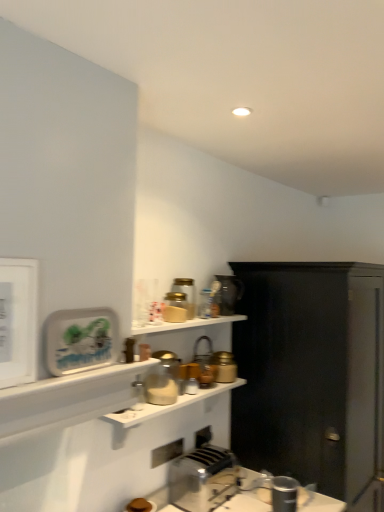
Question: Is matte white plate at upper left, which is the 4th appliance from top to bottom, located outside metallic faucet at upper center, the 3th appliance in the bottom-to-top sequence?

Choices:
 (A) no
 (B) yes

Answer: (B)

Question: Considering the relative sizes of matte white plate at upper left, the 7th appliance when ordered from back to front, and metallic faucet at upper center, the 3th appliance in the bottom-to-top sequence, in the image provided, is matte white plate at upper left, the 7th appliance when ordered from back to front, smaller than metallic faucet at upper center, the 3th appliance in the bottom-to-top sequence,?

Choices:
 (A) no
 (B) yes

Answer: (B)

Question: From a real-world perspective, is matte white plate at upper left, the 7th appliance when ordered from back to front, below metallic faucet at upper center, the 5th appliance positioned from the front?

Choices:
 (A) yes
 (B) no

Answer: (B)

Question: Is matte white plate at upper left, positioned as the 4th appliance in bottom-to-top order, thinner than metallic faucet at upper center, the 5th appliance positioned from the front?

Choices:
 (A) no
 (B) yes

Answer: (B)

Question: Is matte white plate at upper left, which is the first appliance from front to back, wider than metallic faucet at upper center, the 3th appliance in the bottom-to-top sequence?

Choices:
 (A) no
 (B) yes

Answer: (A)

Question: Considering the relative sizes of matte white plate at upper left, the 7th appliance when ordered from back to front, and metallic faucet at upper center, the 3th appliance in the bottom-to-top sequence, in the image provided, is matte white plate at upper left, the 7th appliance when ordered from back to front, shorter than metallic faucet at upper center, the 3th appliance in the bottom-to-top sequence,?

Choices:
 (A) yes
 (B) no

Answer: (A)

Question: Considering the relative sizes of translucent glass jar at upper center, marked as the second appliance in a top-to-bottom arrangement, and black matte cabinet at right in the image provided, is translucent glass jar at upper center, marked as the second appliance in a top-to-bottom arrangement, taller than black matte cabinet at right?

Choices:
 (A) no
 (B) yes

Answer: (A)

Question: Is translucent glass jar at upper center, marked as the second appliance in a top-to-bottom arrangement, not within black matte cabinet at right?

Choices:
 (A) yes
 (B) no

Answer: (A)

Question: From the image's perspective, is translucent glass jar at upper center, placed as the fourth appliance when sorted from front to back, below black matte cabinet at right?

Choices:
 (A) yes
 (B) no

Answer: (B)

Question: From the image's perspective, is translucent glass jar at upper center, which is the 4th appliance in back-to-front order, over black matte cabinet at right?

Choices:
 (A) yes
 (B) no

Answer: (A)

Question: Is translucent glass jar at upper center, placed as the fourth appliance when sorted from front to back, at the left side of black matte cabinet at right?

Choices:
 (A) yes
 (B) no

Answer: (A)

Question: From a real-world perspective, is black matte cabinet at right under translucent glass jar at upper center, placed as the fourth appliance when sorted from front to back?

Choices:
 (A) no
 (B) yes

Answer: (B)